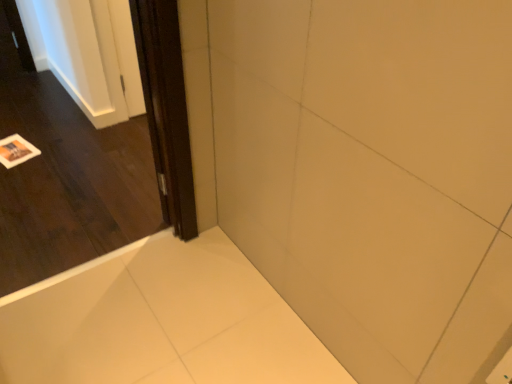
Question: Is dark wood door at left wider or thinner than white glossy bathtub at lower left?

Choices:
 (A) wide
 (B) thin

Answer: (B)

Question: Visually, is dark wood door at left positioned to the left or to the right of white glossy bathtub at lower left?

Choices:
 (A) right
 (B) left

Answer: (B)

Question: Based on their relative distances, which object is farther from the dark wood screen door at left?

Choices:
 (A) dark wood door at left
 (B) white glossy bathtub at lower left

Answer: (A)

Question: Which of these objects is positioned farthest from the dark wood door at left?

Choices:
 (A) dark wood screen door at left
 (B) white glossy bathtub at lower left

Answer: (A)